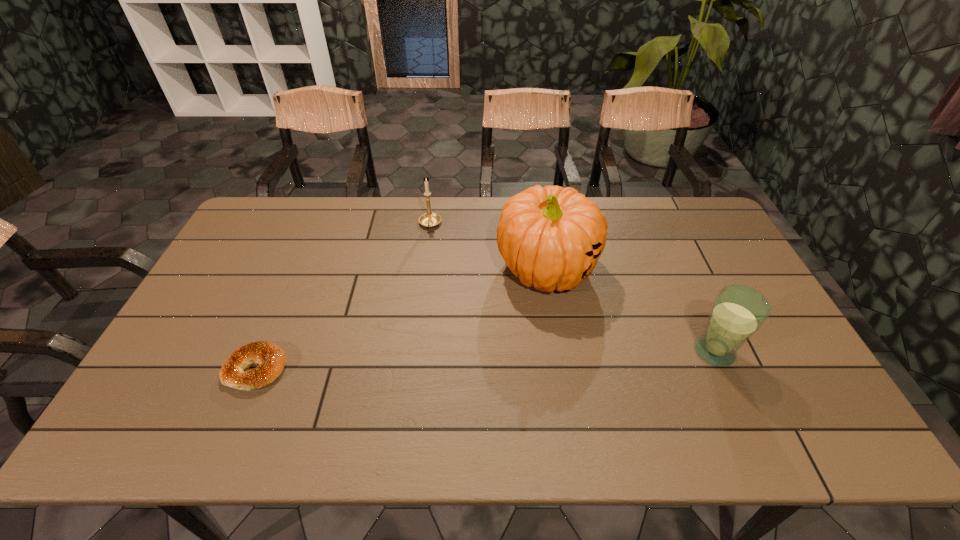
Where is `blank region between the farthest object and the pumpkin`? blank region between the farthest object and the pumpkin is located at coordinates (489, 247).

Locate an element on the screen. object that is the third closest one to the glass is located at coordinates tap(271, 359).

The image size is (960, 540). Find the location of `object that is the second nearest to the farthest object`. object that is the second nearest to the farthest object is located at coordinates (271, 359).

This screenshot has height=540, width=960. In order to click on free location that satisfies the following two spatial constraints: 1. on the back side of the bagel; 2. on the left side of the rightmost object in this screenshot , I will do `click(263, 352)`.

This screenshot has width=960, height=540. Identify the location of free spot that satisfies the following two spatial constraints: 1. on the front side of the rightmost object; 2. on the left side of the third object from right to left. (414, 352).

I want to click on vacant position in the image that satisfies the following two spatial constraints: 1. on the back side of the rightmost object; 2. on the left side of the bagel, so click(263, 352).

Where is `blank area in the image that satisfies the following two spatial constraints: 1. on the back side of the leftmost object; 2. on the right side of the third object from left to right`? The height and width of the screenshot is (540, 960). blank area in the image that satisfies the following two spatial constraints: 1. on the back side of the leftmost object; 2. on the right side of the third object from left to right is located at coordinates (299, 268).

Locate an element on the screen. free space that satisfies the following two spatial constraints: 1. on the back side of the shortest object; 2. on the left side of the third object from left to right is located at coordinates (299, 268).